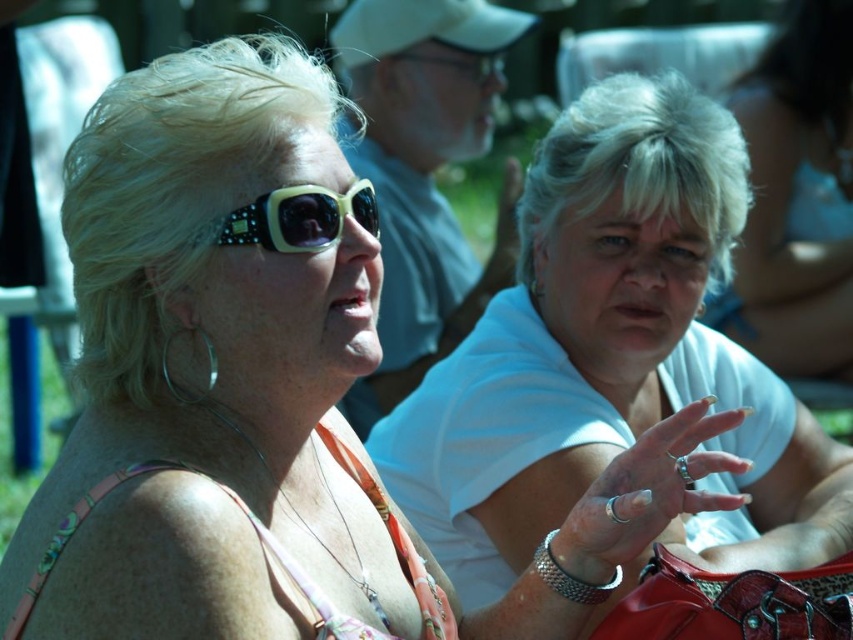
Question: Does white matte shirt at center appear over matte black sunglasses at upper left?

Choices:
 (A) yes
 (B) no

Answer: (B)

Question: Can you confirm if white matte shirt at center is thinner than matte black sunglasses at upper left?

Choices:
 (A) yes
 (B) no

Answer: (B)

Question: Which point is farther from the camera taking this photo?

Choices:
 (A) (334, 225)
 (B) (643, 250)

Answer: (B)

Question: Is white matte shirt at center positioned at the back of matte black sunglasses at upper left?

Choices:
 (A) yes
 (B) no

Answer: (A)

Question: Which object appears closest to the camera in this image?

Choices:
 (A) white matte shirt at center
 (B) matte black sunglasses at upper left

Answer: (B)